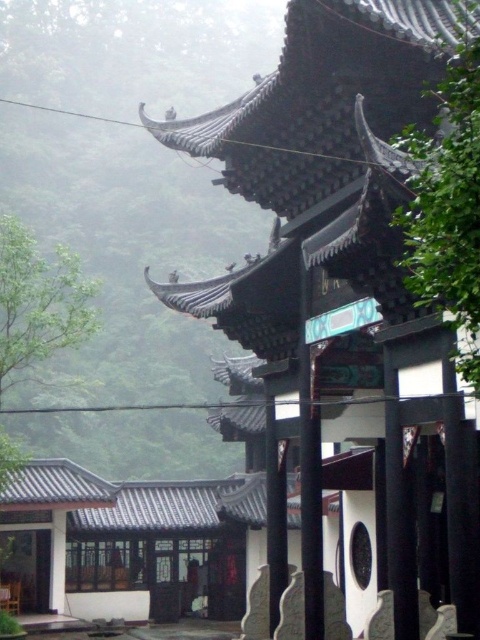
Question: Which point is closer to the camera?

Choices:
 (A) (274, 292)
 (B) (146, 45)

Answer: (A)

Question: Which of the following is the farthest from the observer?

Choices:
 (A) foggy translucent at left
 (B) black tile roof at center

Answer: (A)

Question: Considering the relative positions of black tile roof at center and foggy translucent at left in the image provided, where is black tile roof at center located with respect to foggy translucent at left?

Choices:
 (A) right
 (B) left

Answer: (A)

Question: Does black tile roof at center appear over foggy translucent at left?

Choices:
 (A) no
 (B) yes

Answer: (A)

Question: Is black tile roof at center to the left of foggy translucent at left from the viewer's perspective?

Choices:
 (A) no
 (B) yes

Answer: (A)